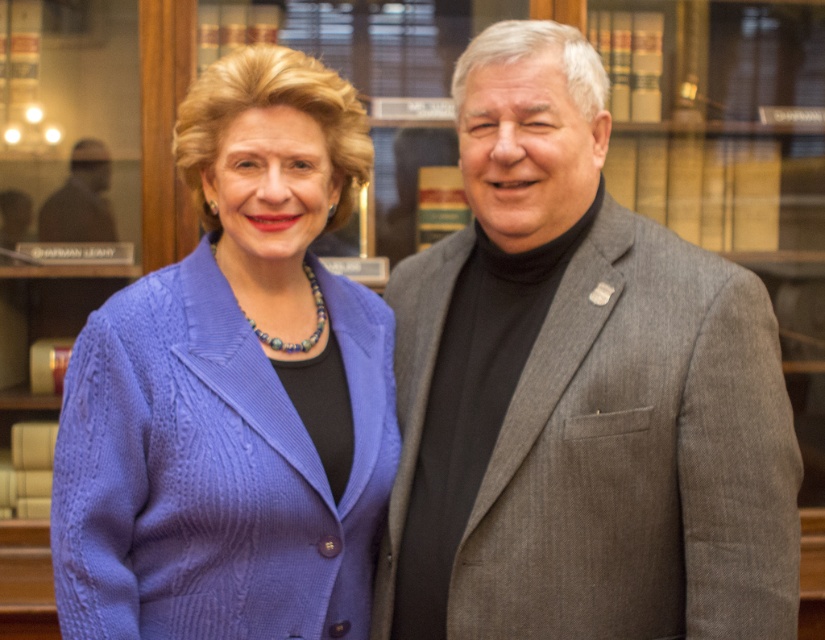
Question: Which of the following is the farthest from the observer?

Choices:
 (A) (437, 388)
 (B) (192, 157)

Answer: (A)

Question: Can you confirm if gray wool suit at center is smaller than cable-knit sweater at left?

Choices:
 (A) yes
 (B) no

Answer: (B)

Question: Is gray wool suit at center below cable-knit sweater at left?

Choices:
 (A) yes
 (B) no

Answer: (A)

Question: Does gray wool suit at center appear on the right side of cable-knit sweater at left?

Choices:
 (A) yes
 (B) no

Answer: (A)